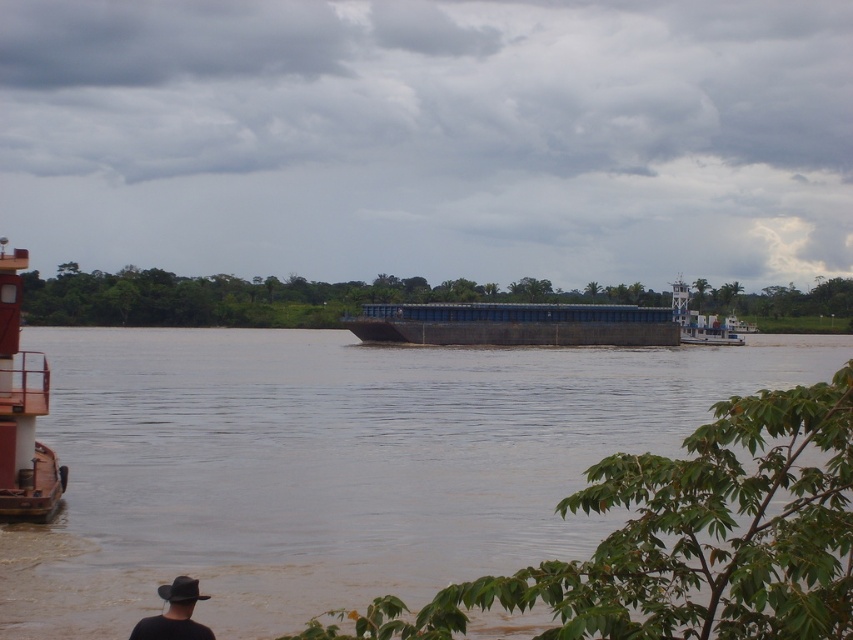
You are navigating a small boat and need to pass between two points marked on the river. The first point is at coordinates point (18, 298) and the second is at point (177, 632). Which point should you approach first if you want to travel downstream along the river?

You should approach point 0.988, 0.209 first because it is ahead of point (18, 298) in the downstream direction.

You are a photographer trying to capture the brown matte river at center and the black leather hat at lower left in the same frame. Based on their positions, which object should you adjust your camera to focus on first to ensure both are in the shot?

The black leather hat at lower left should be focused on first since it is positioned to the left of the brown matte river at center, allowing you to frame both objects by adjusting the camera to include both from left to right.